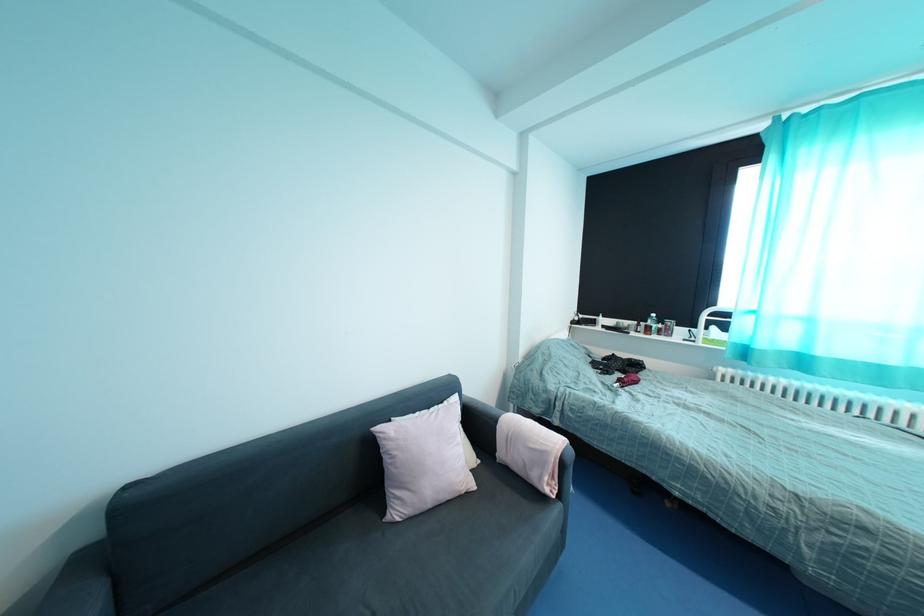
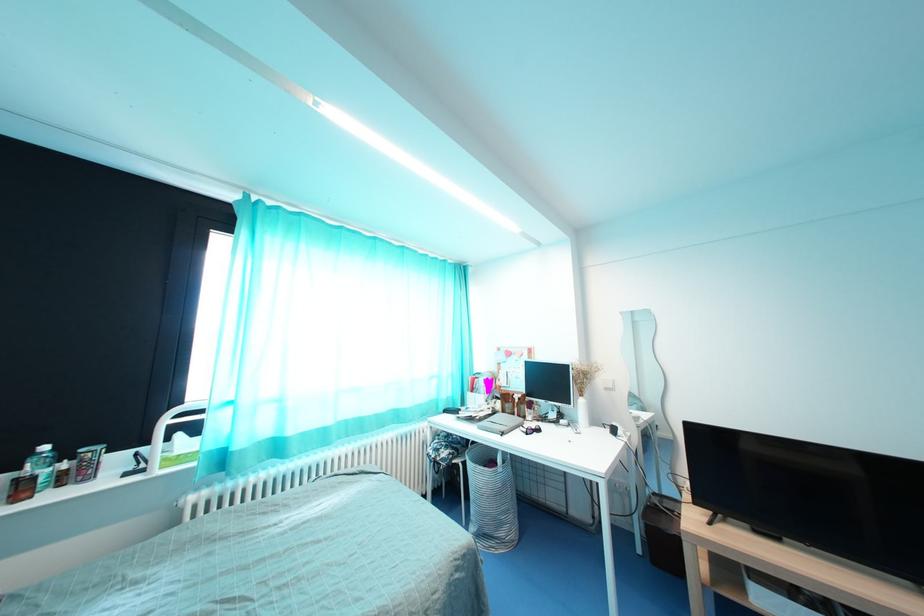
Question: The images are taken continuously from a first-person perspective. In which direction is your viewpoint rotating?

Choices:
 (A) Left
 (B) Right
 (C) Up
 (D) Down

Answer: (B)